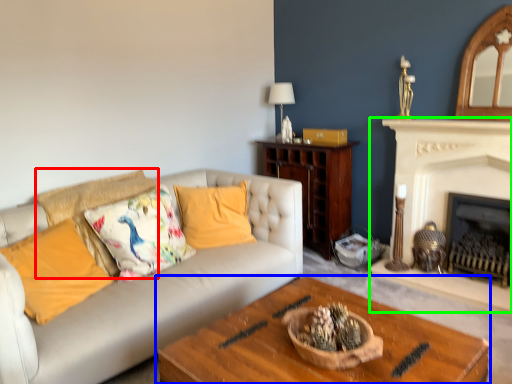
Question: Estimate the real-world distances between objects in this image. Which object is farther from pillow (highlighted by a red box), coffee table (highlighted by a blue box) or fireplace (highlighted by a green box)?

Choices:
 (A) coffee table
 (B) fireplace

Answer: (B)